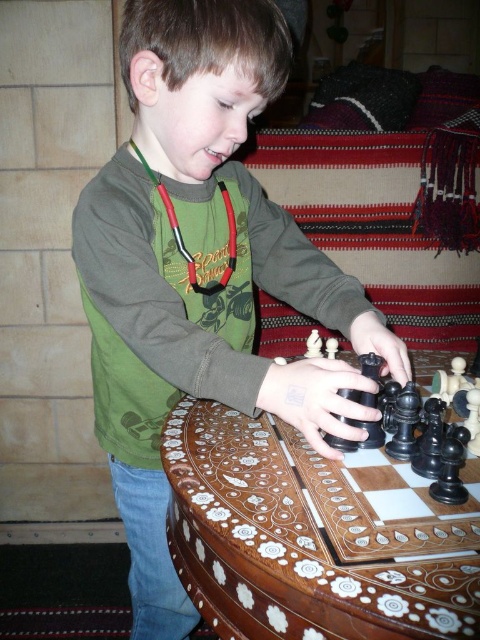
Does green matte shirt at center come behind inlaid wood chessboard at center?

That is True.

Who is more forward, (x=154, y=145) or (x=430, y=484)?

Point (x=430, y=484) is more forward.

The width and height of the screenshot is (480, 640). I want to click on green matte shirt at center, so click(201, 269).

Is point (347, 368) positioned behind point (354, 556)?

Yes, it is.

Who is more forward, (233, 3) or (409, 403)?

Positioned in front is point (233, 3).

Locate an element on the screen. The height and width of the screenshot is (640, 480). green matte shirt at center is located at coordinates (201, 269).

Which is in front, point (427, 582) or point (418, 426)?

Point (427, 582) is more forward.

Which is below, inlaid wood chessboard at center or black glossy chess piece at center?

inlaid wood chessboard at center is below.

Find the location of a particular element. The image size is (480, 640). inlaid wood chessboard at center is located at coordinates (323, 529).